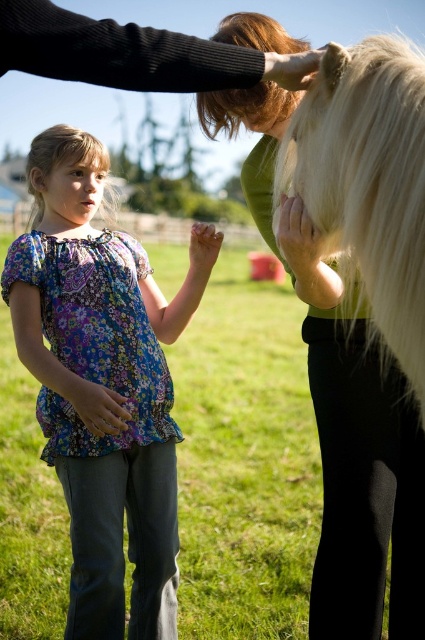
You are a photographer capturing this scene. You want to ensure both the blonde silky hair at center and the blonde silky hair at upper center are clearly visible in the photo. Which one should you adjust the focus to prioritize to avoid one blocking the other?

The blonde silky hair at upper center is behind the blonde silky hair at center. To ensure both are visible without one blocking the other, prioritize focusing on the blonde silky hair at center since it is in front and adjust the depth of field to include the one behind.